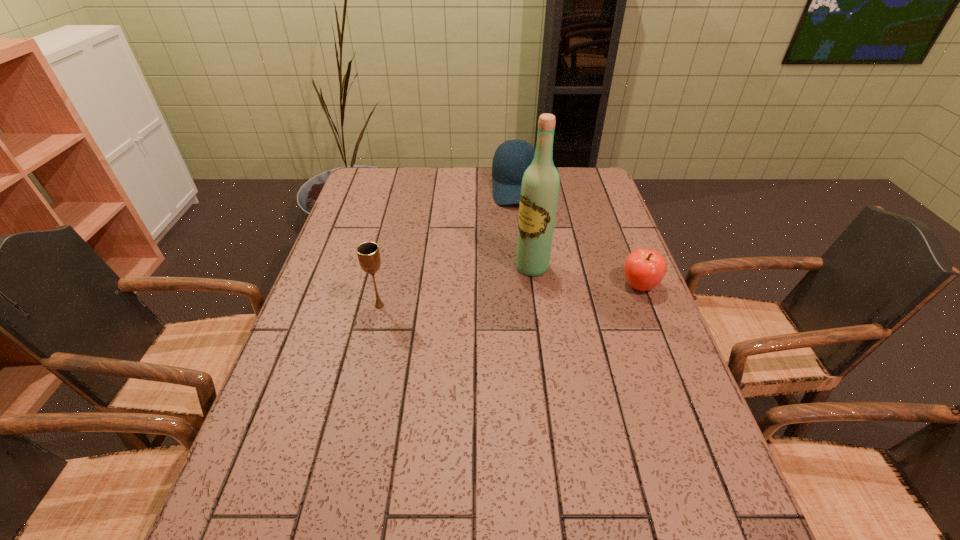
I want to click on free location at the right edge of the desktop, so click(x=684, y=400).

The width and height of the screenshot is (960, 540). I want to click on free space at the far left corner, so click(x=390, y=198).

At what (x,y) coordinates should I click in order to perform the action: click on vacant region at the near left corner of the desktop. Please return your answer as a coordinate pair (x, y). The height and width of the screenshot is (540, 960). Looking at the image, I should click on (256, 488).

At what (x,y) coordinates should I click in order to perform the action: click on free space at the far right corner of the desktop. Please return your answer as a coordinate pair (x, y). Looking at the image, I should click on (566, 181).

Where is `empty space between the third tallest object and the rightmost object`? This screenshot has width=960, height=540. empty space between the third tallest object and the rightmost object is located at coordinates (577, 237).

At what (x,y) coordinates should I click in order to perform the action: click on vacant space that is in between the rightmost object and the tallest object. Please return your answer as a coordinate pair (x, y). This screenshot has height=540, width=960. Looking at the image, I should click on (586, 276).

Find the location of a particular element. This screenshot has width=960, height=540. free space between the tallest object and the second tallest object is located at coordinates (456, 286).

This screenshot has height=540, width=960. I want to click on unoccupied area between the second tallest object and the rightmost object, so click(x=510, y=296).

Image resolution: width=960 pixels, height=540 pixels. In order to click on free space between the apple and the third shortest object in this screenshot , I will do `click(510, 296)`.

This screenshot has height=540, width=960. In order to click on empty space between the wine bottle and the shortest object in this screenshot , I will do `click(586, 276)`.